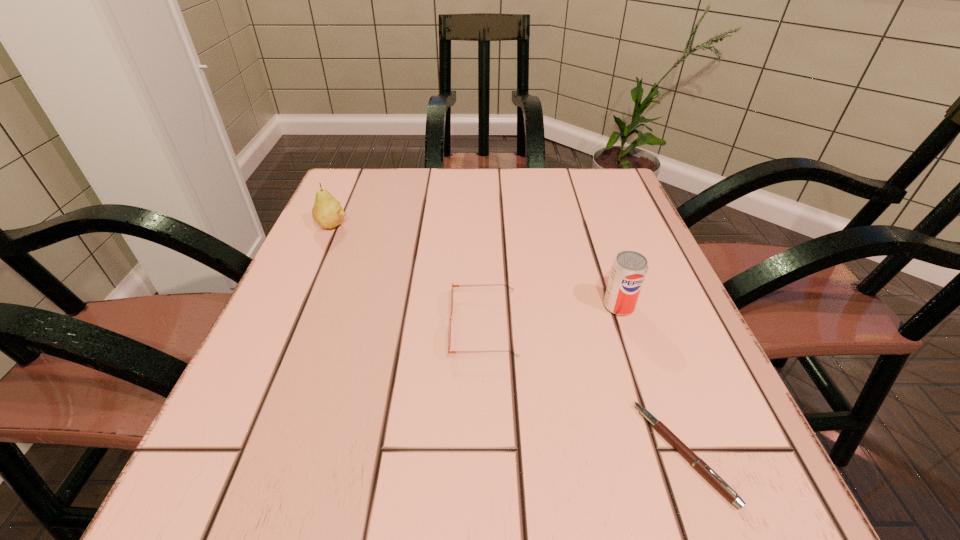
What are the coordinates of `pear` in the screenshot? It's located at (327, 211).

This screenshot has width=960, height=540. I want to click on the leftmost object, so click(x=327, y=211).

Locate an element on the screen. The height and width of the screenshot is (540, 960). soda is located at coordinates (629, 269).

Where is `sunglasses`? This screenshot has height=540, width=960. sunglasses is located at coordinates (449, 330).

You are a GUI agent. You are given a task and a screenshot of the screen. Output one action in this format:
    pyautogui.click(x=<x>, y=<y>)
    Task: Click on the third object from right to left
    The width and height of the screenshot is (960, 540).
    Given the screenshot: What is the action you would take?
    pyautogui.click(x=449, y=330)

Where is `the shortest object`? The width and height of the screenshot is (960, 540). the shortest object is located at coordinates (705, 470).

Find the location of a particular element. the nearest object is located at coordinates (705, 470).

In order to click on vacant region located on the back of the pear in this screenshot , I will do `click(355, 173)`.

Where is `vacant area located on the left of the soda`? The height and width of the screenshot is (540, 960). vacant area located on the left of the soda is located at coordinates (559, 306).

Identify the location of vacant space located on the face of the third object from right to left. The height and width of the screenshot is (540, 960). (328, 326).